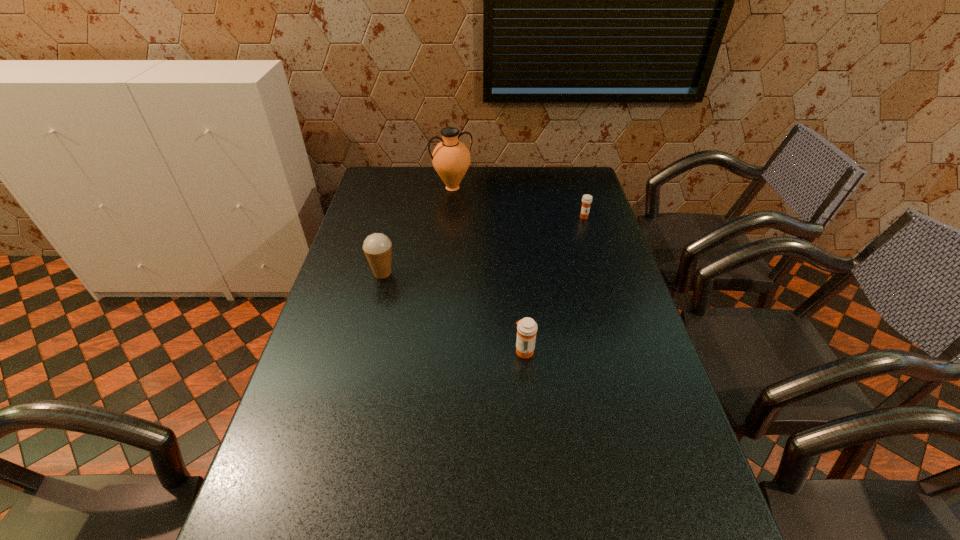
This screenshot has height=540, width=960. Find the location of `blank space located on the front of the third object from left to right`. blank space located on the front of the third object from left to right is located at coordinates (535, 464).

Where is `free space located 0.080m on the label side of the right medicine`? free space located 0.080m on the label side of the right medicine is located at coordinates (588, 233).

I want to click on object located at the far edge, so click(x=451, y=159).

You are a GUI agent. You are given a task and a screenshot of the screen. Output one action in this format:
    pyautogui.click(x=<x>, y=<y>)
    Task: Click on the object that is at the left edge
    
    Given the screenshot: What is the action you would take?
    pyautogui.click(x=377, y=247)

Locate an element on the screen. The height and width of the screenshot is (540, 960). object present at the right edge is located at coordinates (586, 199).

Locate an element on the screen. The image size is (960, 540). vacant region at the far edge of the desktop is located at coordinates (473, 182).

Identify the location of free space at the left edge of the desktop. This screenshot has width=960, height=540. (325, 322).

The height and width of the screenshot is (540, 960). In the image, there is a desktop. What are the coordinates of `vacant space at the right edge` in the screenshot? It's located at (632, 455).

Identify the location of vacant space at the far right corner. (570, 193).

Where is `free space between the leftmost object and the farthest object`? This screenshot has height=540, width=960. free space between the leftmost object and the farthest object is located at coordinates (418, 231).